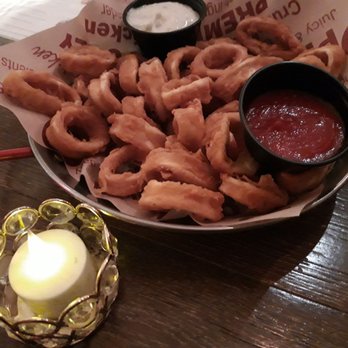
Where is `candle holder`? The width and height of the screenshot is (348, 348). candle holder is located at coordinates (107, 293).